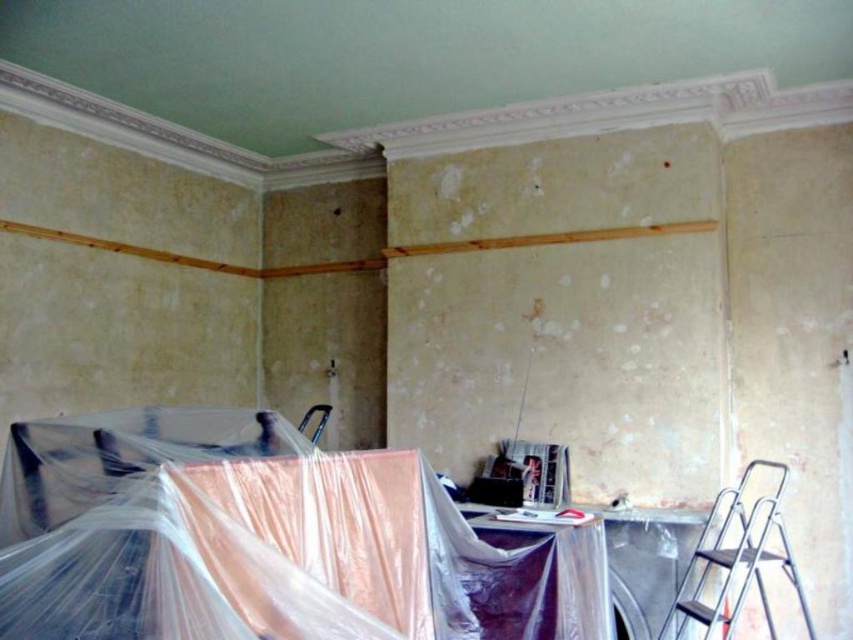
You are a painter working in this room and need to retrieve your tools from under the clear plastic at lower center. Can you access them without moving the silver metallic ladder at lower right?

The clear plastic at lower center is positioned over the silver metallic ladder at lower right, so you cannot access the tools without moving the ladder first.